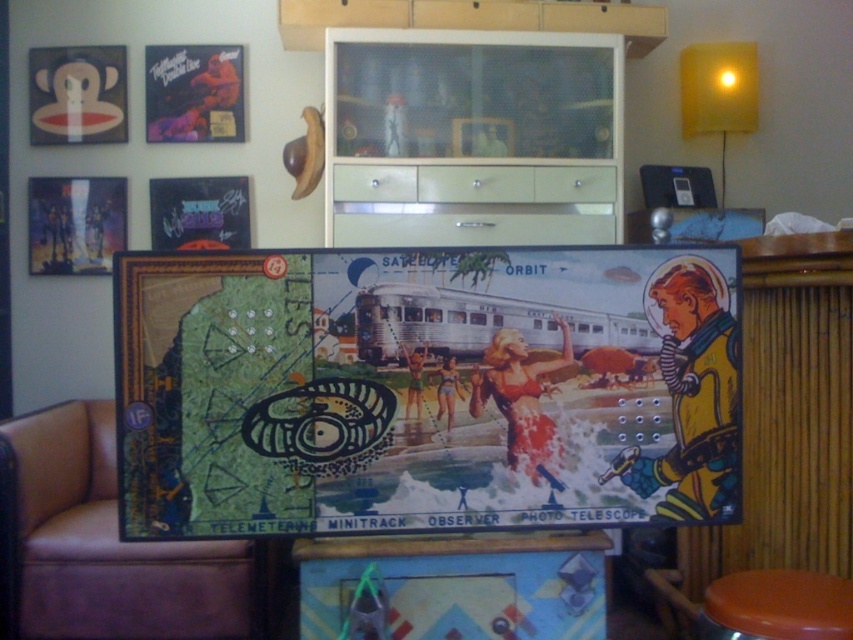
Does point (146, 621) lie in front of point (44, 248)?

Yes.

Does brown leather couch at lower left have a greater width compared to matte black poster at upper left?

Correct, the width of brown leather couch at lower left exceeds that of matte black poster at upper left.

What do you see at coordinates (106, 545) in the screenshot?
I see `brown leather couch at lower left` at bounding box center [106, 545].

You are a GUI agent. You are given a task and a screenshot of the screen. Output one action in this format:
    pyautogui.click(x=<x>, y=<y>)
    Task: Click on the brown leather couch at lower left
    Image resolution: width=853 pixels, height=640 pixels.
    Given the screenshot: What is the action you would take?
    pyautogui.click(x=106, y=545)

Is shiny metallic poster at center to the left of matte black poster at upper left from the viewer's perspective?

In fact, shiny metallic poster at center is to the right of matte black poster at upper left.

Who is more forward, (315, 310) or (126, 193)?

Point (315, 310) is more forward.

Is point (433, 332) positioned behind point (109, 204)?

No, (433, 332) is in front of (109, 204).

The width and height of the screenshot is (853, 640). What are the coordinates of `shiny metallic poster at center` in the screenshot? It's located at (424, 388).

Locate an element on the screen. brown leather couch at lower left is located at coordinates (106, 545).

The image size is (853, 640). Describe the element at coordinates (106, 545) in the screenshot. I see `brown leather couch at lower left` at that location.

What do you see at coordinates (106, 545) in the screenshot? The image size is (853, 640). I see `brown leather couch at lower left` at bounding box center [106, 545].

Locate an element on the screen. The width and height of the screenshot is (853, 640). brown leather couch at lower left is located at coordinates (106, 545).